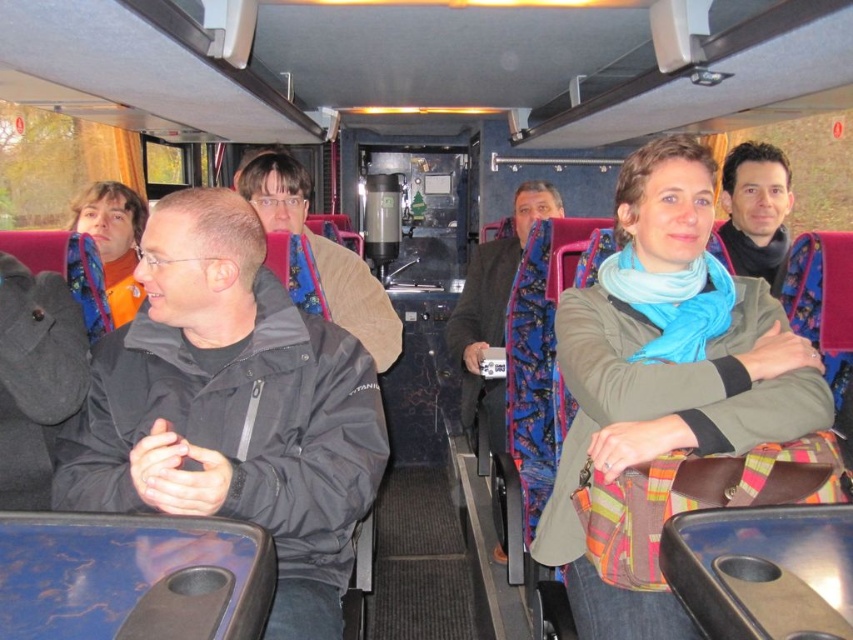
You are a tour guide standing at the front of the bus and want to address both the black matte jacket at left and the blue patterned coat at center. Which passenger should you look down at to speak to them first?

The black matte jacket at left is located below the blue patterned coat at center, so you should look down at the black matte jacket at left first since it is lower in position.

You are a tour guide standing at the front of the bus. You notice two items at center in the image, the light blue scarf at center and the blue patterned coat at center. Which item has a greater width?

The light blue scarf at center has a greater width than the blue patterned coat at center according to the description.

You are a passenger on this bus who wants to hand a brochure to the person wearing the light blue scarf at center and the blue patterned coat at center. Since you are standing in the aisle, which of the two should you approach first based on their proximity to you?

The light blue scarf at center is closer to the viewer than the blue patterned coat at center, so you should approach the light blue scarf at center first.